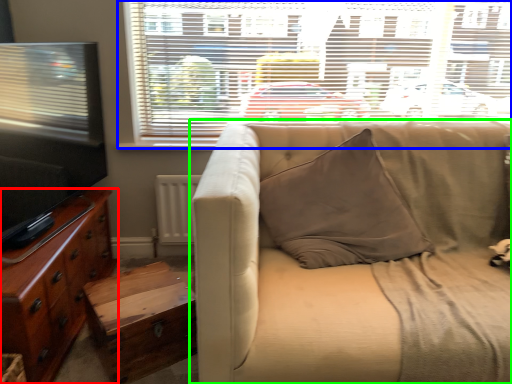
Question: Based on their relative distances, which object is farther from cabinetry (highlighted by a red box)? Choose from window (highlighted by a blue box) and studio couch (highlighted by a green box).

Choices:
 (A) window
 (B) studio couch

Answer: (A)